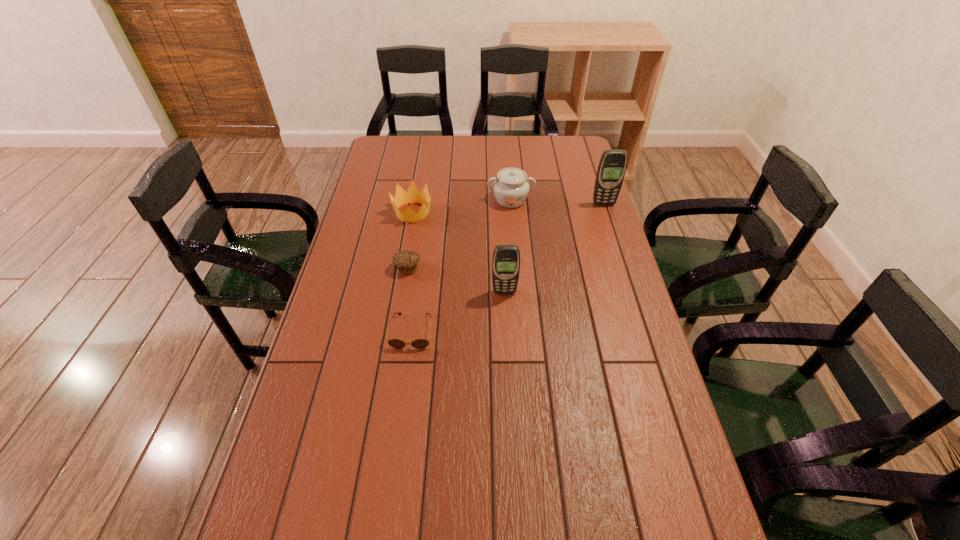
Where is `vacant space at the right edge of the desktop`? vacant space at the right edge of the desktop is located at coordinates (566, 206).

You are a GUI agent. You are given a task and a screenshot of the screen. Output one action in this format:
    pyautogui.click(x=<x>, y=<y>)
    Task: Click on the free space at the far left corner of the desktop
    This screenshot has height=540, width=960.
    Given the screenshot: What is the action you would take?
    pyautogui.click(x=411, y=138)

At what (x,y) coordinates should I click in order to perform the action: click on empty space that is in between the third tallest object and the fifth tallest object. Please return your answer as a coordinate pair (x, y). This screenshot has width=960, height=540. Looking at the image, I should click on (459, 234).

Find the location of a particular element. free spot between the taller cellular telephone and the fourth shortest object is located at coordinates (557, 202).

Identify the location of vacant space that's between the sunglasses and the second nearest object. Image resolution: width=960 pixels, height=540 pixels. pyautogui.click(x=458, y=312).

Where is `vacant space in between the shorter cellular telephone and the right cellular telephone`? The width and height of the screenshot is (960, 540). vacant space in between the shorter cellular telephone and the right cellular telephone is located at coordinates (554, 248).

Where is `free space between the crown and the third nearest object`? free space between the crown and the third nearest object is located at coordinates (410, 240).

Find the location of `vacant region between the fourth shortest object and the shortest object`. vacant region between the fourth shortest object and the shortest object is located at coordinates [461, 266].

Identify which object is the third closest to the sunglasses. Please provide its 2D coordinates. Your answer should be formatted as a tuple, i.e. [(x, y)], where the tuple contains the x and y coordinates of a point satisfying the conditions above.

[(413, 195)]

Identify the location of object that is the second closest to the fourth shortest object. (612, 166).